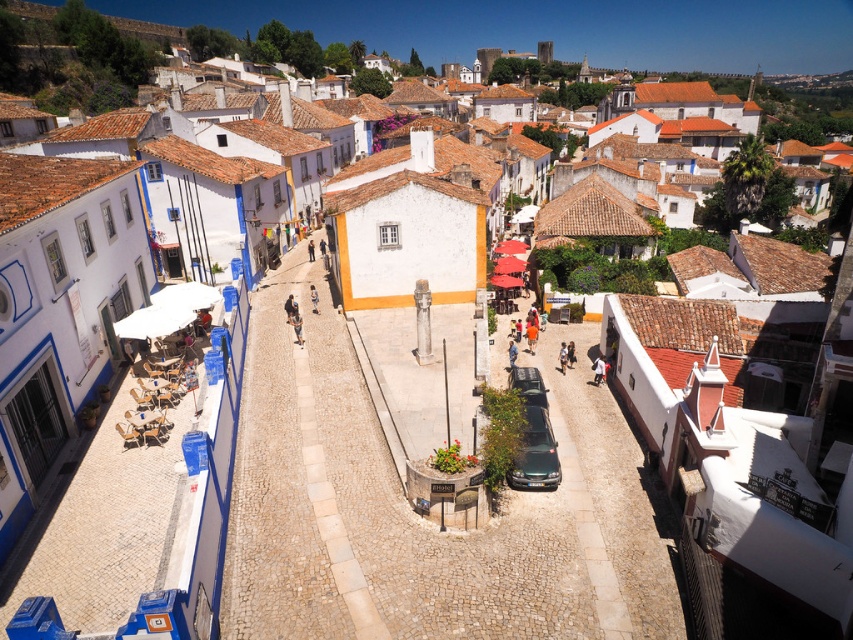
You are a tour guide leading a group down the cobblestone street. You notice two cars parked at the center of the street. Which car takes up more space on the road? The metallic green car at center or the metallic gray car at center?

The metallic green car at center takes up more space on the road because it is bigger than the metallic gray car at center.

You are a tourist standing at the entrance of the cobblestone street. You want to take a photo of the blue walls on the left side of the street. However, there is a metallic green car at center blocking your view. Can you walk around the car to get an unobstructed view of the blue walls on the left side?

The metallic green car at center is positioned at coordinates (537, 452), which is towards the lower right of the scene. To get an unobstructed view of the blue walls on the left side, you can walk around the car to your left side, as the car is not directly in front of the blue walls but positioned off to the right side of the street.

You are a delivery person trying to park a van that is 3 meters long. You see the metallic green car at center and the metallic gray car at center. Can you fit your van between them?

The distance between the metallic green car at center and the metallic gray car at center is 2.68 meters, which is shorter than the van length of 3 meters. Therefore, the van cannot fit between them.